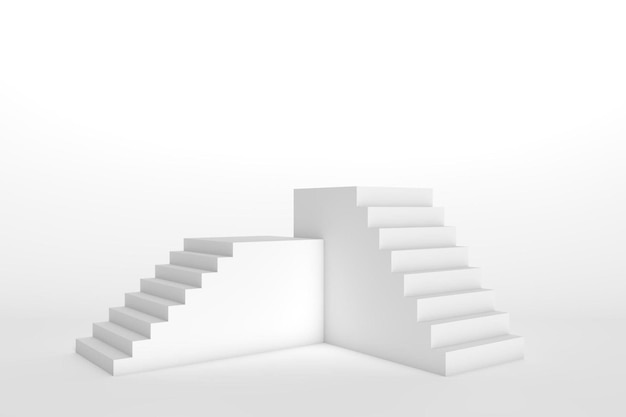
In order to click on stair treads on right stairway in this screenshot , I will do `click(501, 338)`, `click(476, 314)`, `click(458, 291)`, `click(443, 268)`, `click(431, 249)`, `click(419, 224)`, `click(414, 206)`.